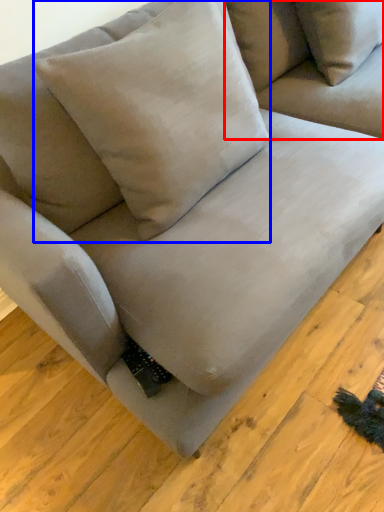
Question: Which of the following is the closest to the observer, couch (highlighted by a red box) or pillow (highlighted by a blue box)?

Choices:
 (A) couch
 (B) pillow

Answer: (B)